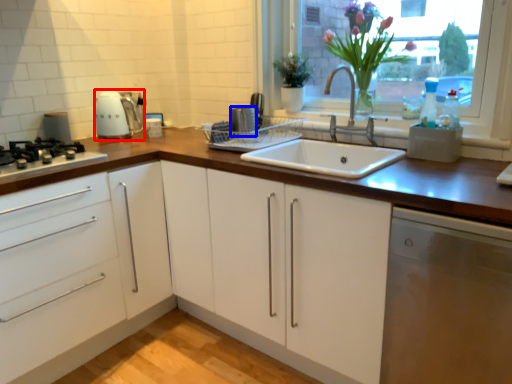
Question: Which object appears farthest to the camera in this image, kitchen appliance (highlighted by a red box) or appliance (highlighted by a blue box)?

Choices:
 (A) kitchen appliance
 (B) appliance

Answer: (A)